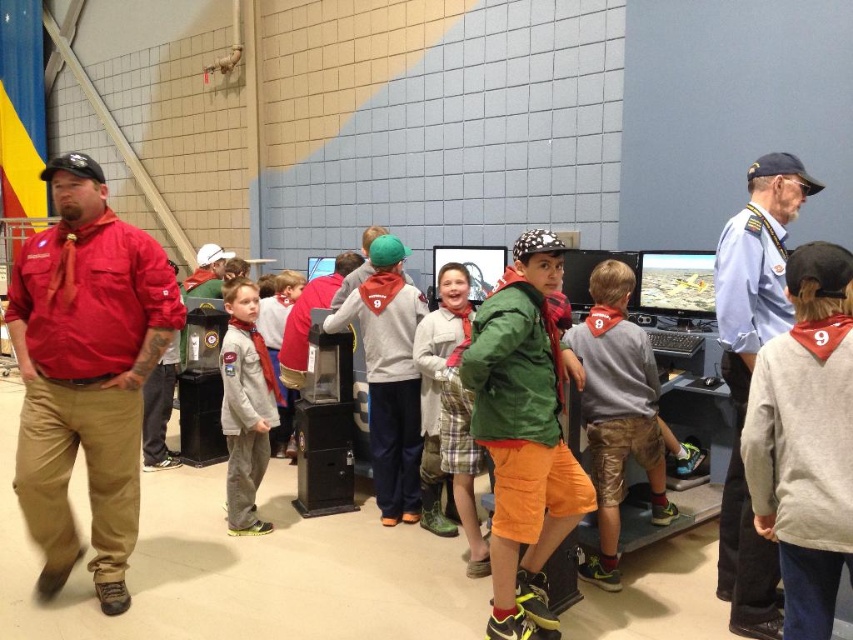
You are standing at the origin point in the image. Where is the gray sweatshirt at center located in terms of coordinates?

The gray sweatshirt at center is located at coordinates point (x=618, y=412).

Based on the photo, you are a photographer trying to capture a clear shot of the gray sweatshirt at center and the green plaid pants at center. Since you want to focus on both, which object should you adjust your camera settings to prioritize in terms of size in the frame?

The gray sweatshirt at center is larger in size than the green plaid pants at center, so you should prioritize focusing on the gray sweatshirt at center as it occupies more space in the frame.

Where is the red cotton shirt at left located in the image?

The red cotton shirt at left is located at the point with coordinates 0.583 on the x axis and 0.101 on the y axis.